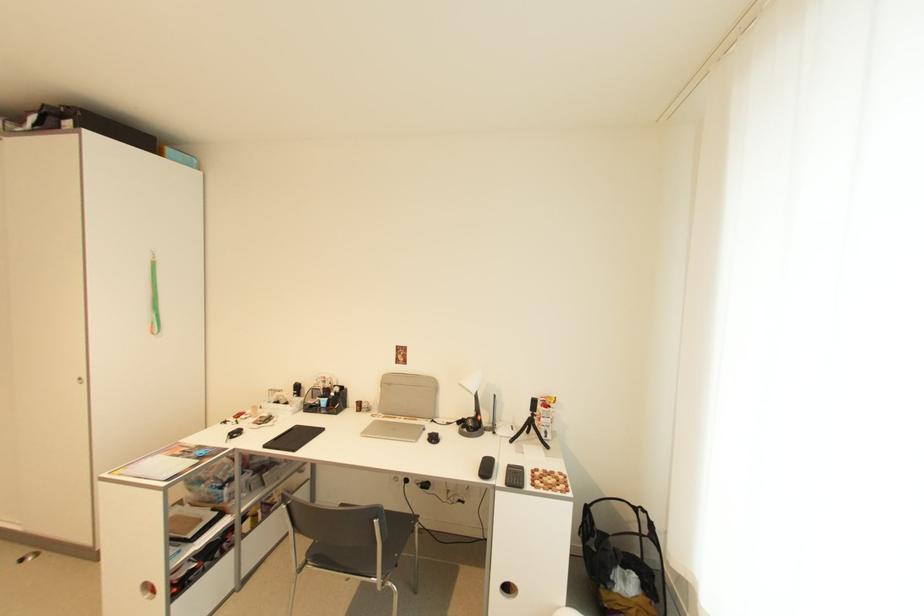
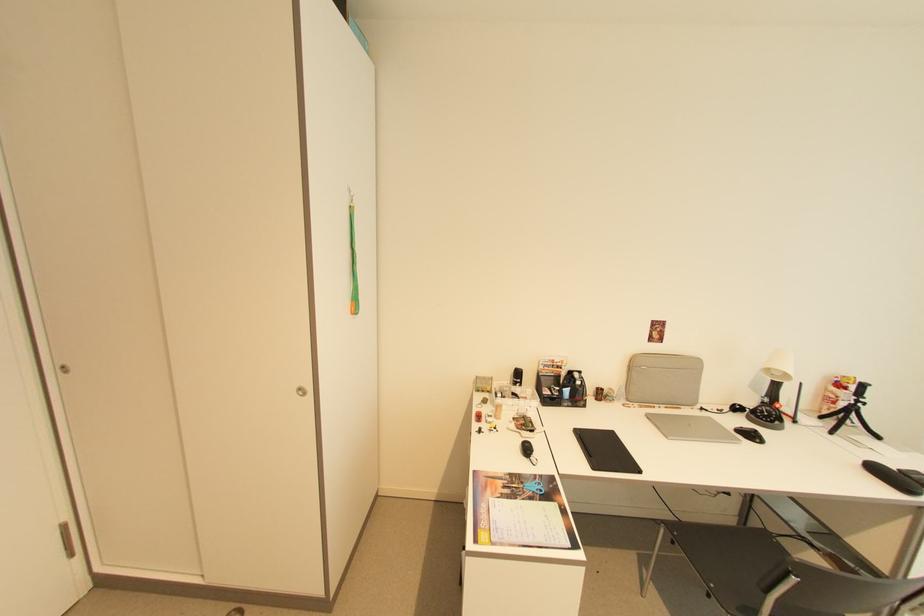
In the second image, find the point that corresponds to point (188, 451) in the first image.

(505, 484)